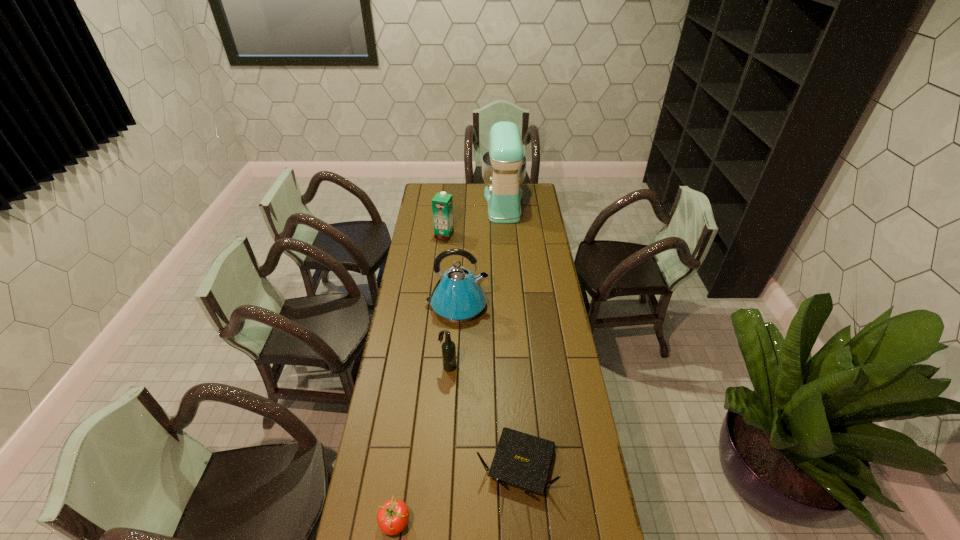
I want to click on the tallest object, so click(x=504, y=166).

At what (x,y) coordinates should I click in order to perform the action: click on mixer. Please return your answer as a coordinate pair (x, y). Looking at the image, I should click on (504, 166).

At what (x,y) coordinates should I click in order to perform the action: click on kettle. Please return your answer as a coordinate pair (x, y). The image size is (960, 540). Looking at the image, I should click on (458, 296).

Identify the location of the fifth shortest object. (458, 296).

At what (x,y) coordinates should I click in order to perform the action: click on the fourth shortest object. Please return your answer as a coordinate pair (x, y). The height and width of the screenshot is (540, 960). Looking at the image, I should click on (442, 204).

Image resolution: width=960 pixels, height=540 pixels. Identify the location of the fifth nearest object. (442, 204).

At what (x,y) coordinates should I click in order to perform the action: click on beer bottle. Please return your answer as a coordinate pair (x, y). Image resolution: width=960 pixels, height=540 pixels. Looking at the image, I should click on (448, 347).

Locate an element on the screen. the third shortest object is located at coordinates (448, 347).

Find the location of a particular element. This screenshot has width=960, height=540. the fifth tallest object is located at coordinates (520, 459).

The width and height of the screenshot is (960, 540). I want to click on free point located 0.070m at the base of the farthest object, so click(x=470, y=203).